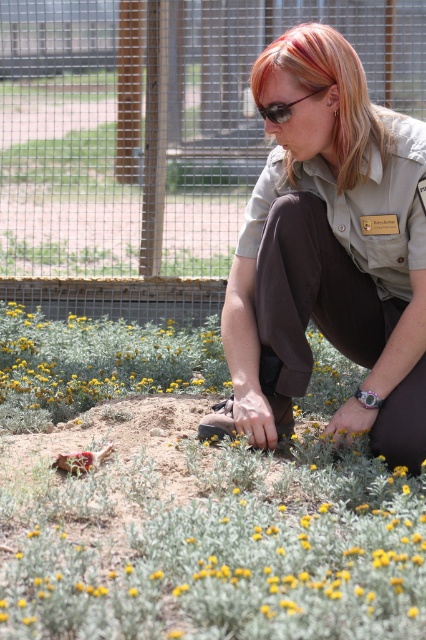
Is brown uniform at center taller than blonde hair at center?

Yes, brown uniform at center is taller than blonde hair at center.

Can you confirm if brown uniform at center is positioned below blonde hair at center?

Yes, brown uniform at center is below blonde hair at center.

You are a GUI agent. You are given a task and a screenshot of the screen. Output one action in this format:
    pyautogui.click(x=<x>, y=<y>)
    Task: Click on the brown uniform at center
    The image size is (426, 640).
    Given the screenshot: What is the action you would take?
    pyautogui.click(x=328, y=253)

Is point (368, 211) in front of point (278, 122)?

No, it is not.

Can you confirm if brown uniform at center is smaller than matte black sunglasses at center?

Actually, brown uniform at center might be larger than matte black sunglasses at center.

Is point (268, 104) more distant than point (307, 97)?

Yes, point (268, 104) is farther from viewer.

Where is `brown uniform at center`? This screenshot has height=640, width=426. brown uniform at center is located at coordinates (328, 253).

Is blonde hair at center behind matte black sunglasses at center?

No, it is not.

Is blonde hair at center taller than matte black sunglasses at center?

Yes, blonde hair at center is taller than matte black sunglasses at center.

Identify the location of blonde hair at center. This screenshot has width=426, height=640. (324, 93).